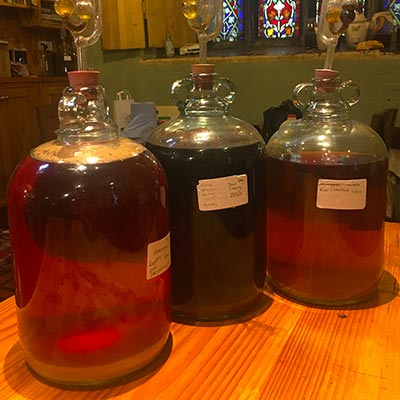
Identify the location of stained glass. Image resolution: width=400 pixels, height=400 pixels. (283, 13), (229, 16).